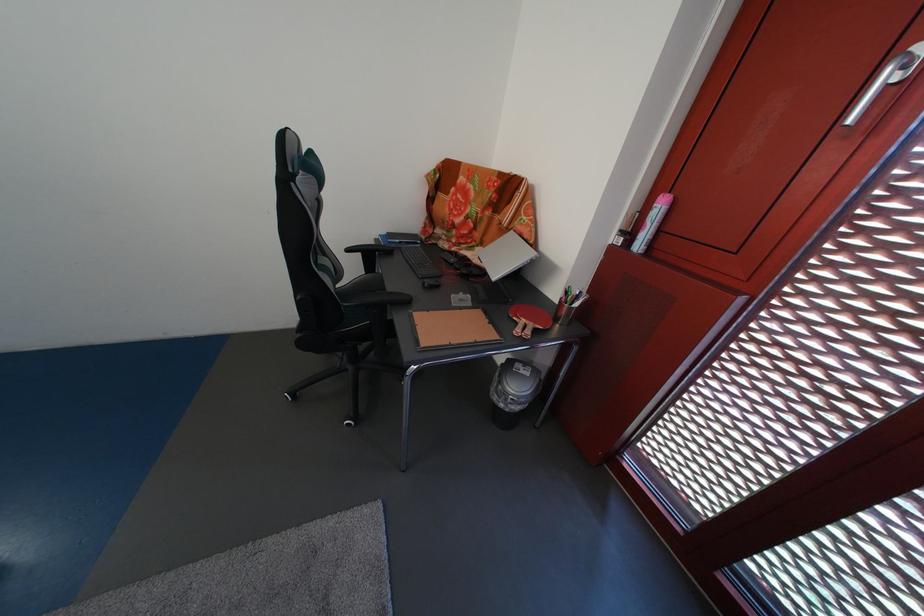
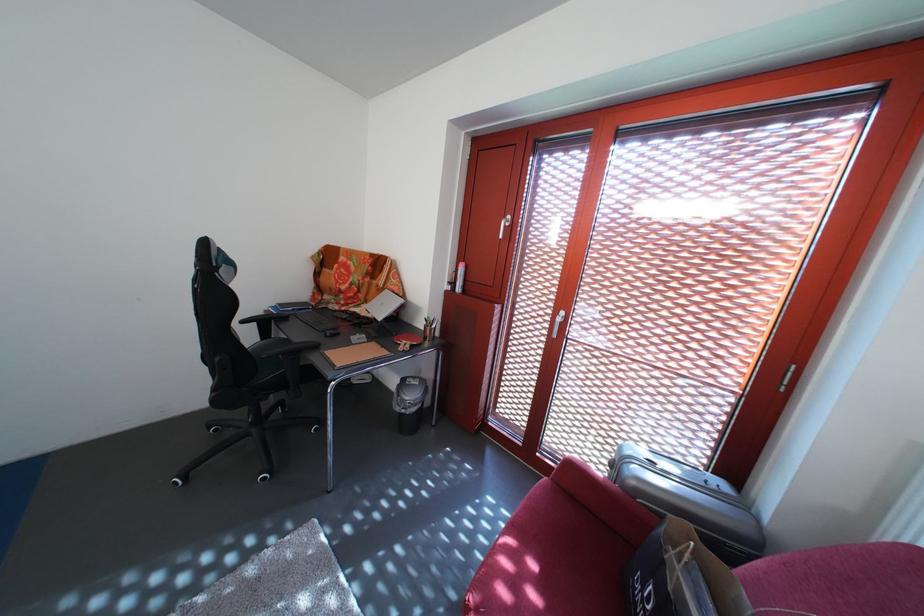
Question: How did the camera likely rotate?

Choices:
 (A) Left
 (B) Right
 (C) Up
 (D) Down

Answer: (B)